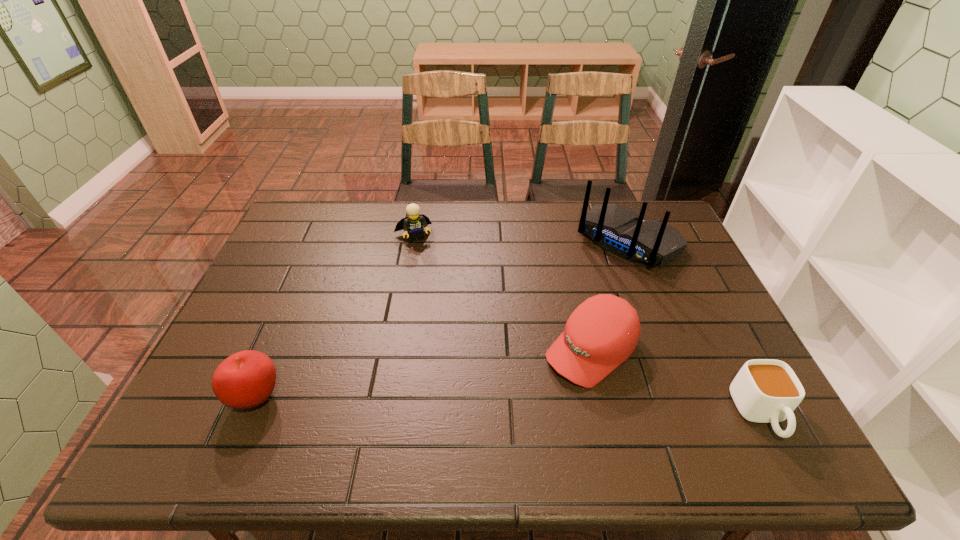
The image size is (960, 540). What are the coordinates of `free space at the far right corner` in the screenshot? It's located at (646, 220).

Where is `free space between the cap and the cup`? The image size is (960, 540). free space between the cap and the cup is located at coordinates (676, 383).

Find the location of a particular element. The image size is (960, 540). vacant area that lies between the shortest object and the router is located at coordinates (694, 328).

Locate an element on the screen. This screenshot has width=960, height=540. free space between the leftmost object and the Lego is located at coordinates 334,317.

Locate an element on the screen. This screenshot has width=960, height=540. unoccupied position between the cap and the Lego is located at coordinates (502, 293).

Locate an element on the screen. This screenshot has height=540, width=960. vacant area that lies between the leftmost object and the cap is located at coordinates (423, 374).

The image size is (960, 540). What are the coordinates of `free space between the tallest object and the apple` in the screenshot? It's located at (442, 320).

The image size is (960, 540). Identify the location of free space between the tallest object and the shortest object. (694, 328).

Image resolution: width=960 pixels, height=540 pixels. In order to click on empty location between the cap and the cup in this screenshot , I will do click(x=676, y=383).

You are a GUI agent. You are given a task and a screenshot of the screen. Output one action in this format:
    pyautogui.click(x=<x>, y=<y>)
    Task: Click on the vacant space that's between the shortest object and the leftmost object
    
    Given the screenshot: What is the action you would take?
    pyautogui.click(x=508, y=406)